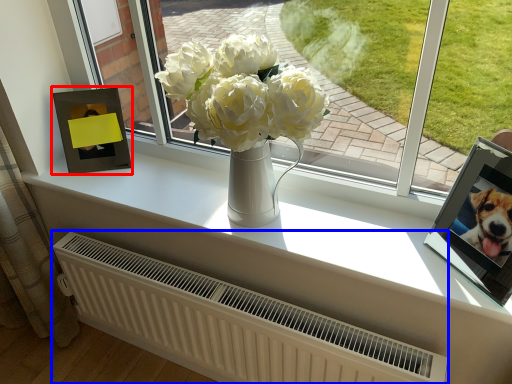
Question: Which object appears farthest to the camera in this image, picture frame (highlighted by a red box) or radiator (highlighted by a blue box)?

Choices:
 (A) picture frame
 (B) radiator

Answer: (A)